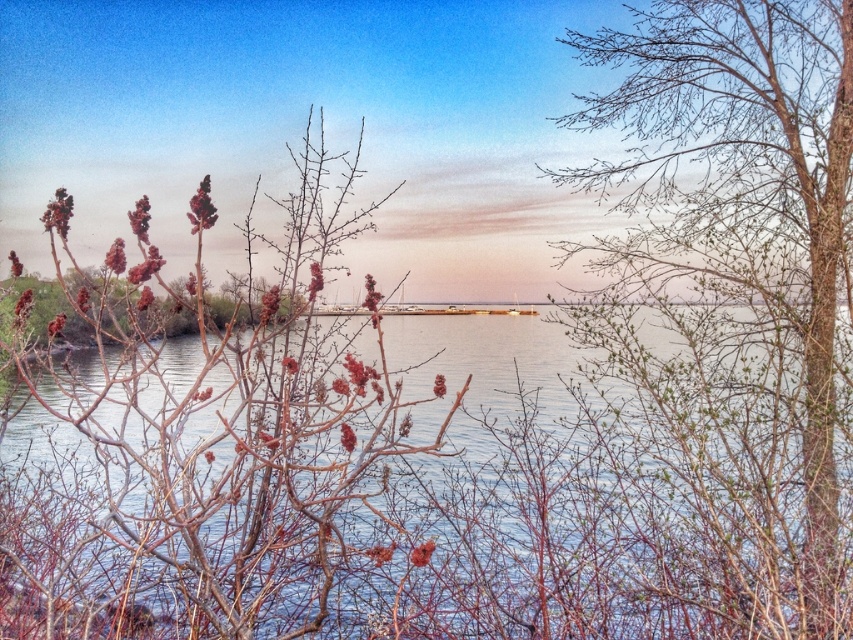
You are an artist planning to paint this lakeside scene. You want to ensure that the clear water at center and the bare branches at left are both visible in your painting. Given their sizes in the image, which object should you make larger in your artwork?

The clear water at center is bigger than the bare branches at left in the image, so you should paint the clear water at center larger than the bare branches at left to accurately represent their sizes.